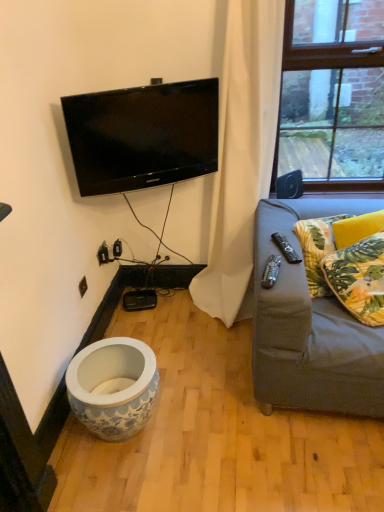
What do you see at coordinates (242, 153) in the screenshot? This screenshot has height=512, width=384. I see `white fabric curtain at upper right` at bounding box center [242, 153].

What is the approximate width of green leafy fabric pillow at right, which is the second pillow in back-to-front order?

green leafy fabric pillow at right, which is the second pillow in back-to-front order, is 12.66 inches in width.

What do you see at coordinates (113, 387) in the screenshot? Image resolution: width=384 pixels, height=512 pixels. I see `white glossy vase at lower left` at bounding box center [113, 387].

Where is `yellow floral fabric pillow at right, marked as the first pillow in a back-to-front arrangement`? The image size is (384, 512). yellow floral fabric pillow at right, marked as the first pillow in a back-to-front arrangement is located at coordinates (317, 250).

Measure the distance between point [296,263] and camera.

They are 1.69 meters apart.

Find the location of a particular element. dark gray fabric couch at right is located at coordinates (311, 323).

From their relative heights in the image, would you say black glossy tv at upper center is taller or shorter than yellow floral fabric pillow at right, the second pillow positioned from the front?

black glossy tv at upper center is taller than yellow floral fabric pillow at right, the second pillow positioned from the front.

Would you say yellow floral fabric pillow at right, the second pillow positioned from the front, is part of black glossy tv at upper center's contents?

No, black glossy tv at upper center does not contain yellow floral fabric pillow at right, the second pillow positioned from the front.

Which object is thinner, black glossy tv at upper center or yellow floral fabric pillow at right, the second pillow positioned from the front?

With smaller width is black glossy tv at upper center.

Is black glossy tv at upper center touching yellow floral fabric pillow at right, the second pillow positioned from the front?

They are not placed beside each other.

From a real-world perspective, which is physically above, white glossy vase at lower left or dark gray fabric couch at right?

dark gray fabric couch at right, from a real-world perspective.

Are white glossy vase at lower left and dark gray fabric couch at right located far from each other?

That's not correct — white glossy vase at lower left is a little close to dark gray fabric couch at right.

From the image's perspective, which is above, white glossy vase at lower left or dark gray fabric couch at right?

dark gray fabric couch at right is shown above in the image.

Is white glossy vase at lower left positioned with its back to dark gray fabric couch at right?

white glossy vase at lower left does not have its back to dark gray fabric couch at right.

Is green leafy fabric pillow at right, which is the second pillow in back-to-front order, situated inside black plastic remote at right or outside?

green leafy fabric pillow at right, which is the second pillow in back-to-front order, exists outside the volume of black plastic remote at right.

Which point is more distant from viewer, (x=365, y=312) or (x=286, y=246)?

The point (x=286, y=246) is farther from the camera.

From the image's perspective, between green leafy fabric pillow at right, the 1th pillow viewed from the front, and black plastic remote at right, which one is located above?

black plastic remote at right.

The image size is (384, 512). In order to click on remote to the left of green leafy fabric pillow at right, the 1th pillow viewed from the front in this screenshot , I will do `click(286, 248)`.

Does white fabric curtain at upper right have a larger size compared to black glossy tv at upper center?

Indeed, white fabric curtain at upper right has a larger size compared to black glossy tv at upper center.

Choose the correct answer: Is white fabric curtain at upper right inside black glossy tv at upper center or outside it?

white fabric curtain at upper right cannot be found inside black glossy tv at upper center.

How distant is white fabric curtain at upper right from black glossy tv at upper center?

white fabric curtain at upper right is 15.02 inches away from black glossy tv at upper center.

Can you confirm if white fabric curtain at upper right is positioned to the left of black glossy tv at upper center?

No, white fabric curtain at upper right is not to the left of black glossy tv at upper center.

How different are the orientations of black glossy tv at upper center and black plastic remote at right in degrees?

13.1 degrees separate the facing orientations of black glossy tv at upper center and black plastic remote at right.

Does black glossy tv at upper center turn towards black plastic remote at right?

Yes, black glossy tv at upper center is oriented towards black plastic remote at right.

Is black glossy tv at upper center to the left or to the right of black plastic remote at right in the image?

Clearly, black glossy tv at upper center is on the left of black plastic remote at right in the image.

Would you say black glossy tv at upper center is a long distance from black plastic remote at right?

Actually, black glossy tv at upper center and black plastic remote at right are a little close together.

Which of these two, black plastic remote at right or yellow floral fabric pillow at right, the second pillow positioned from the front, is smaller?

black plastic remote at right is smaller.

Looking at this image, considering the relative sizes of black plastic remote at right and yellow floral fabric pillow at right, marked as the first pillow in a back-to-front arrangement, in the image provided, is black plastic remote at right shorter than yellow floral fabric pillow at right, marked as the first pillow in a back-to-front arrangement,?

Yes.

Would you say black plastic remote at right is a long distance from yellow floral fabric pillow at right, marked as the first pillow in a back-to-front arrangement?

No, black plastic remote at right is in close proximity to yellow floral fabric pillow at right, marked as the first pillow in a back-to-front arrangement.

Is the depth of black plastic remote at right greater than that of yellow floral fabric pillow at right, the second pillow positioned from the front?

No, black plastic remote at right is in front of yellow floral fabric pillow at right, the second pillow positioned from the front.

Consider the image. Which is more to the right, white glossy vase at lower left or white fabric curtain at upper right?

From the viewer's perspective, white fabric curtain at upper right appears more on the right side.

Considering the relative sizes of white glossy vase at lower left and white fabric curtain at upper right in the image provided, is white glossy vase at lower left smaller than white fabric curtain at upper right?

Indeed, white glossy vase at lower left has a smaller size compared to white fabric curtain at upper right.

How many degrees apart are the facing directions of white glossy vase at lower left and white fabric curtain at upper right?

88.3 degrees.

Relative to white fabric curtain at upper right, is white glossy vase at lower left in front or behind?

In the image, white glossy vase at lower left appears behind white fabric curtain at upper right.

There is a black glossy tv at upper center. At what (x,y) coordinates should I click in order to perform the action: click on the 1st pillow below it (from the image's perspective). Please return your answer as a coordinate pair (x, y). This screenshot has height=512, width=384. Looking at the image, I should click on (317, 250).

Find the location of a particular element. studio couch in front of the white glossy vase at lower left is located at coordinates (311, 323).

In the scene shown: Estimate the real-world distances between objects in this image. Which object is closer to green leafy fabric pillow at right, the 1th pillow viewed from the front, black glossy tv at upper center or white fabric curtain at upper right?

Based on the image, white fabric curtain at upper right appears to be nearer to green leafy fabric pillow at right, the 1th pillow viewed from the front.

From the picture: From the image, which object appears to be nearer to white fabric curtain at upper right, dark gray fabric couch at right or white glossy vase at lower left?

Among the two, dark gray fabric couch at right is located nearer to white fabric curtain at upper right.

Which object lies nearer to the anchor point dark gray fabric couch at right, green leafy fabric pillow at right, which is the second pillow in back-to-front order, or white glossy vase at lower left?

Among the two, green leafy fabric pillow at right, which is the second pillow in back-to-front order, is located nearer to dark gray fabric couch at right.

When comparing their distances from yellow floral fabric pillow at right, marked as the first pillow in a back-to-front arrangement, does white fabric curtain at upper right or white glossy vase at lower left seem further?

The object further to yellow floral fabric pillow at right, marked as the first pillow in a back-to-front arrangement, is white glossy vase at lower left.

Considering their positions, is white glossy vase at lower left positioned closer to black glossy tv at upper center than dark gray fabric couch at right?

dark gray fabric couch at right is closer to black glossy tv at upper center.

Considering their positions, is yellow floral fabric pillow at right, marked as the first pillow in a back-to-front arrangement, positioned closer to dark gray fabric couch at right than white glossy vase at lower left?

Based on the image, yellow floral fabric pillow at right, marked as the first pillow in a back-to-front arrangement, appears to be nearer to dark gray fabric couch at right.

Which object lies further to the anchor point black plastic remote at right, black glossy tv at upper center or dark gray fabric couch at right?

The object further to black plastic remote at right is black glossy tv at upper center.

When comparing their distances from black plastic remote at right, does white fabric curtain at upper right or dark gray fabric couch at right seem closer?

dark gray fabric couch at right is positioned closer to the anchor black plastic remote at right.

The height and width of the screenshot is (512, 384). What are the coordinates of `pillow between black plastic remote at right and green leafy fabric pillow at right, the 1th pillow viewed from the front, from left to right` in the screenshot? It's located at (317, 250).

Locate an element on the screen. remote situated between black glossy tv at upper center and green leafy fabric pillow at right, which is the second pillow in back-to-front order, from left to right is located at coordinates (286, 248).

The image size is (384, 512). In order to click on pillow between black glossy tv at upper center and green leafy fabric pillow at right, the 1th pillow viewed from the front in this screenshot , I will do `click(317, 250)`.

What are the coordinates of `pillow between white fabric curtain at upper right and green leafy fabric pillow at right, which is the second pillow in back-to-front order, in the horizontal direction` in the screenshot? It's located at (317, 250).